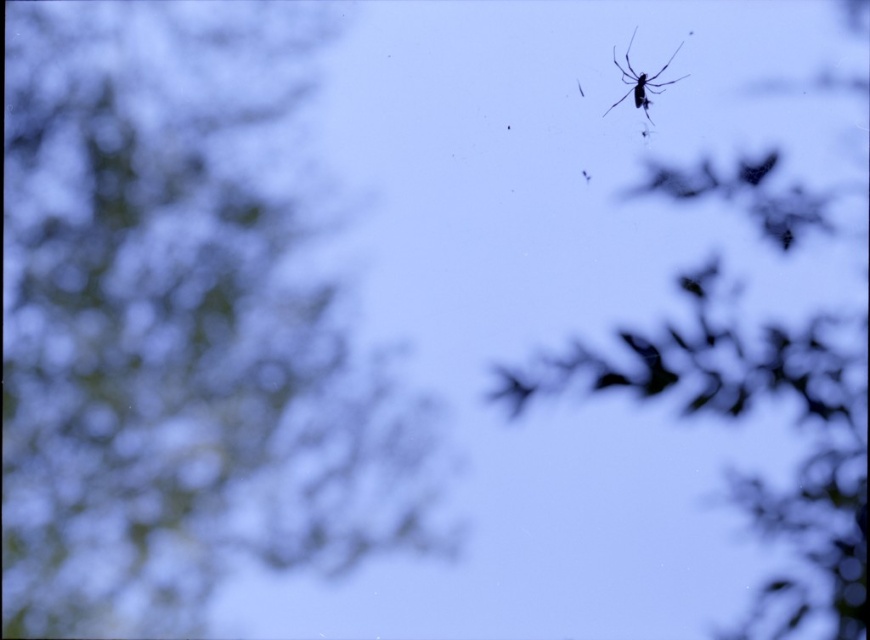
You are a photographer trying to capture the transparent silk spider at upper right. You notice the silvery metallic branch at upper right in the background. Will the branch be visible behind the spider in your photo?

The silvery metallic branch at upper right is positioned under the transparent silk spider at upper right, so the branch will be visible behind the spider in the photo.

In the scene shown: You are a bird flying towards the green matte tree at upper left and the transparent silk spider at upper right. Which object will you encounter first?

The green matte tree at upper left is in front of the transparent silk spider at upper right, so you will encounter the green matte tree at upper left first.

You are an artist trying to paint this scene. You want to ensure the green matte tree at upper left and the silvery metallic branch at upper right are proportionally accurate. Which object should you paint larger to maintain the scene proportions?

The green matte tree at upper left should be painted larger than the silvery metallic branch at upper right because it has a larger size in the scene.